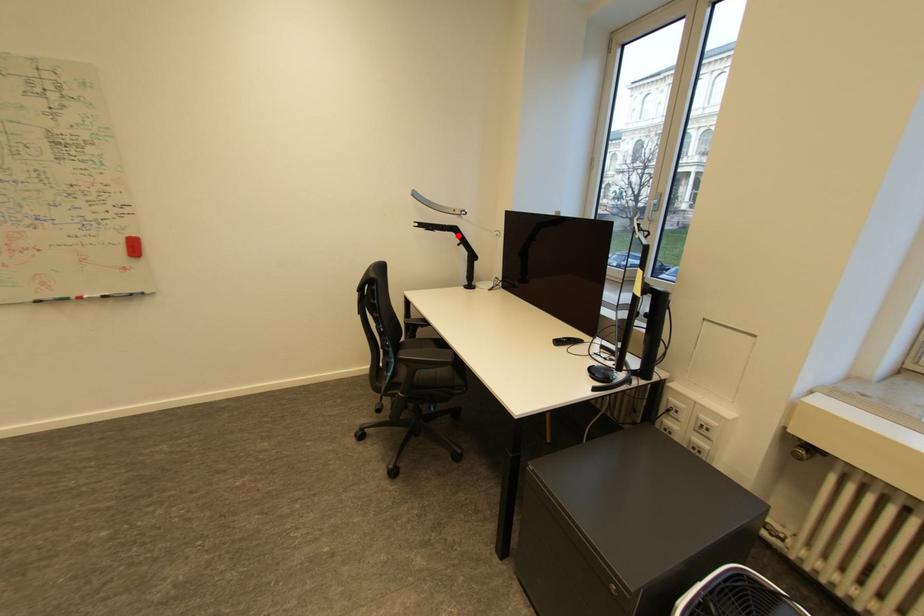
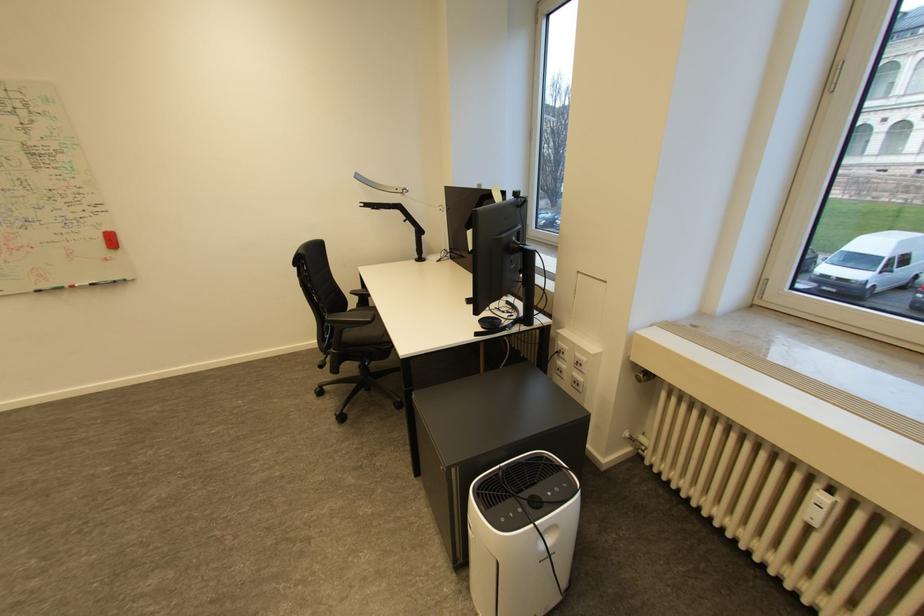
Locate, in the second image, the point that corresponds to the highlighted location in the first image.

(405, 213)